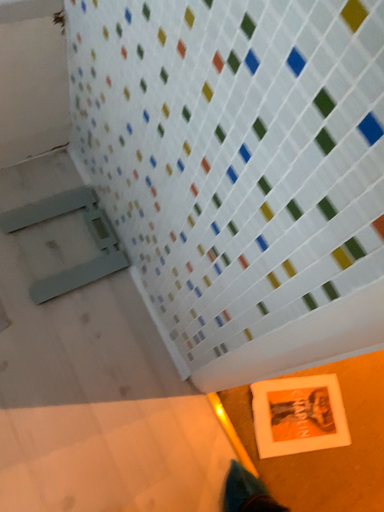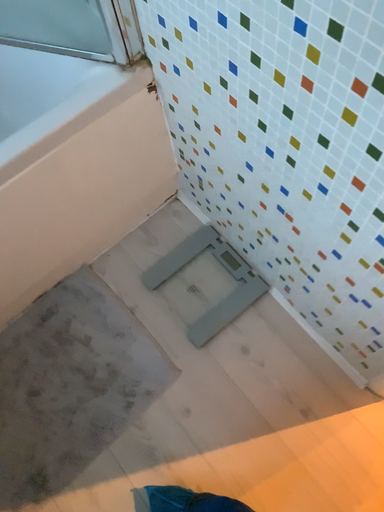
Question: How did the camera likely rotate when shooting the video?

Choices:
 (A) rotated right
 (B) rotated left

Answer: (B)